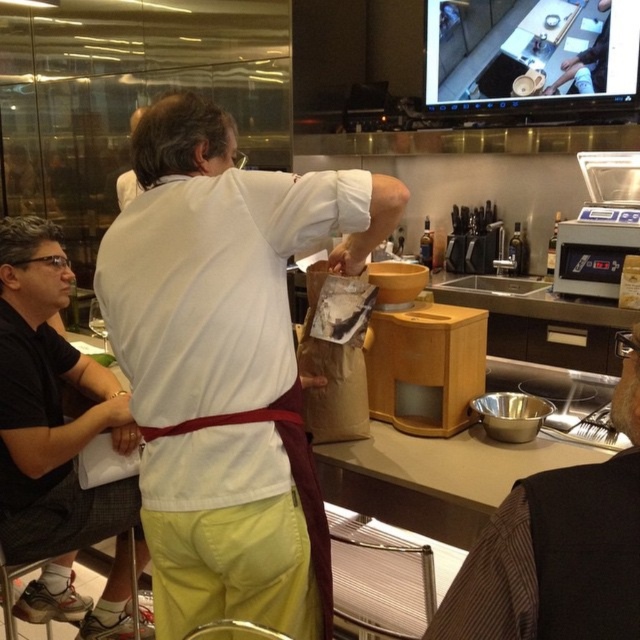
You are standing in the kitchen and need to find the white matte shirt at center. According to the scene description, where exactly is the white matte shirt located?

The white matte shirt at center is located at point 0.570 on the x axis and 0.353 on the y axis.

You are a customer in a coffee shop and you want to know which clothing item is taller between the white matte shirt at center and the brown fabric vest at lower right. Can you tell me?

The white matte shirt at center is taller than the brown fabric vest at lower right according to the description.